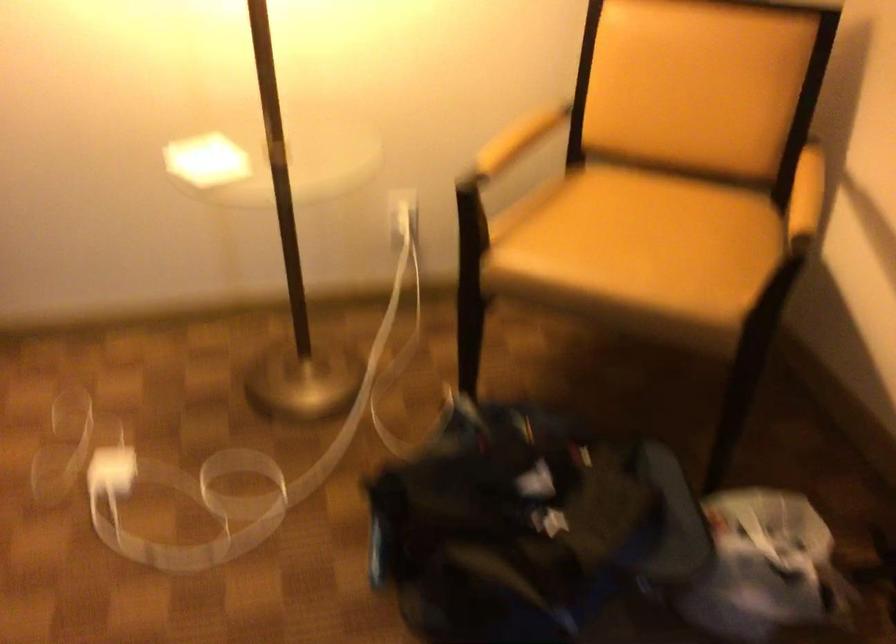
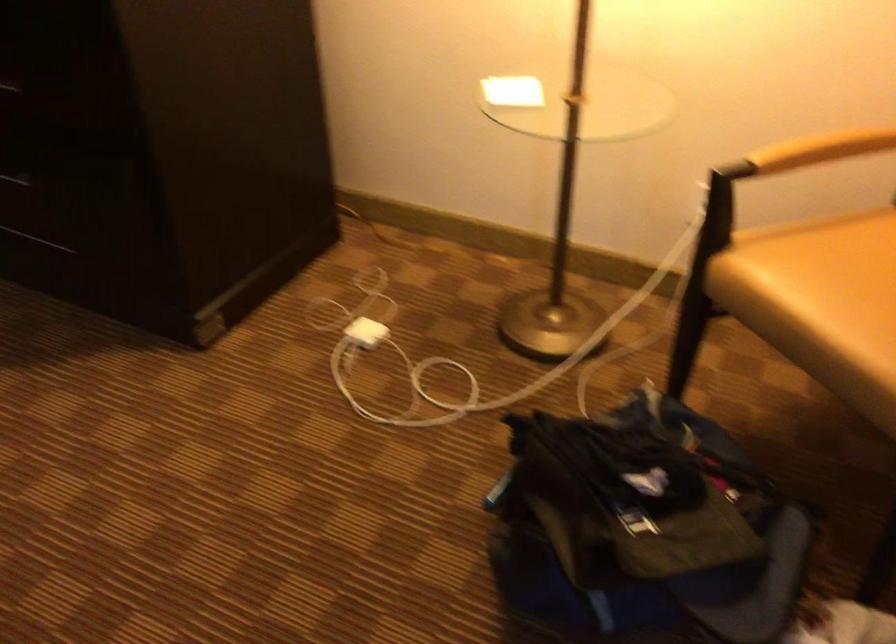
The point at [531,136] is marked in the first image. Where is the corresponding point in the second image?

(821, 149)